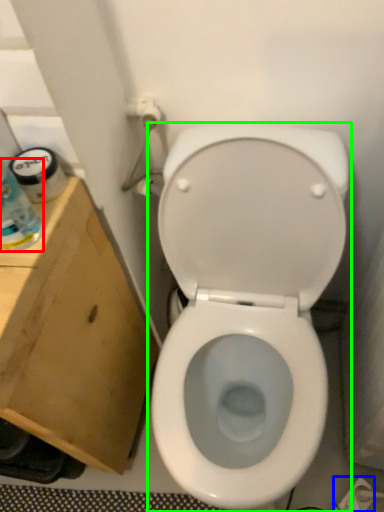
Question: Which is farther away from bottle (highlighted by a red box)? electric outlet (highlighted by a blue box) or toilet (highlighted by a green box)?

Choices:
 (A) electric outlet
 (B) toilet

Answer: (A)